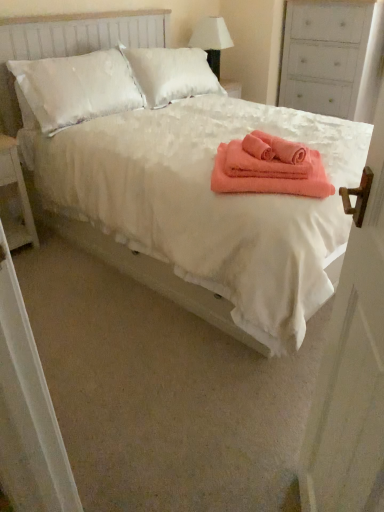
Describe the element at coordinates (76, 33) in the screenshot. The width and height of the screenshot is (384, 512). I see `coral soft towel at center` at that location.

Describe the element at coordinates (269, 168) in the screenshot. I see `coral plush bath towel at center` at that location.

What is the approximate height of coral plush bath towel at center?

coral plush bath towel at center is 3.92 inches in height.

Describe the element at coordinates (262, 161) in the screenshot. I see `coral soft towel at center` at that location.

Identify the location of white fabric lampshade at upper center. (212, 40).

Where is `coral soft towel at center`? The height and width of the screenshot is (512, 384). coral soft towel at center is located at coordinates (76, 33).

Can we say white wood nightstand at left lies outside coral soft towel at center?

Yes.

How far apart are white wood nightstand at left and coral soft towel at center?

white wood nightstand at left and coral soft towel at center are 4.57 feet apart from each other.

Based on the photo, does white wood nightstand at left have a greater height compared to coral soft towel at center?

Yes, white wood nightstand at left is taller than coral soft towel at center.

Is the depth of white wood nightstand at left greater than that of coral soft towel at center?

Yes, white wood nightstand at left is further from the camera.

Could you tell me if white painted wood dresser at upper right is turned towards white wood nightstand at left?

Yes.

What's the angular difference between white painted wood dresser at upper right and white wood nightstand at left's facing directions?

The facing directions of white painted wood dresser at upper right and white wood nightstand at left are 90 degrees apart.

From a real-world perspective, between white painted wood dresser at upper right and white wood nightstand at left, who is vertically higher?

In real-world perspective, white painted wood dresser at upper right is above.

Is there a large distance between white painted wood dresser at upper right and white wood nightstand at left?

white painted wood dresser at upper right is positioned a significant distance from white wood nightstand at left.

Based on their positions, is white fabric lampshade at upper center located to the left or right of white wooden door at right?

In the image, white fabric lampshade at upper center appears on the left side of white wooden door at right.

Is white fabric lampshade at upper center looking in the opposite direction of white wooden door at right?

No.

Which is nearer, (x=225, y=24) or (x=372, y=459)?

Point (x=225, y=24) appears to be farther away from the viewer than point (x=372, y=459).

Is coral soft towel at center in contact with coral soft towel at center?

No, coral soft towel at center is not making contact with coral soft towel at center.

The height and width of the screenshot is (512, 384). Find the location of `bed below the coral soft towel at center (from a real-world perspective)`. bed below the coral soft towel at center (from a real-world perspective) is located at coordinates (76, 33).

Considering their positions, is coral soft towel at center located in front of or behind coral soft towel at center?

Clearly, coral soft towel at center is in front of coral soft towel at center.

Which is more to the left, coral soft towel at center or coral soft towel at center?

coral soft towel at center.

Between white fabric lampshade at upper center and white painted wood dresser at upper right, which one has more height?

Standing taller between the two is white painted wood dresser at upper right.

Where is `table lamp above the white painted wood dresser at upper right (from the image's perspective)`? The height and width of the screenshot is (512, 384). table lamp above the white painted wood dresser at upper right (from the image's perspective) is located at coordinates (212, 40).

Is white fabric lampshade at upper center to the right of white painted wood dresser at upper right from the viewer's perspective?

Incorrect, white fabric lampshade at upper center is not on the right side of white painted wood dresser at upper right.

From a real-world perspective, is white fabric lampshade at upper center on white painted wood dresser at upper right?

Yes, from a real-world perspective, white fabric lampshade at upper center is above white painted wood dresser at upper right.

Is coral plush bath towel at center behind white painted wood dresser at upper right?

No.

From a real-world perspective, which object rests below the other?

coral plush bath towel at center is physically lower.

Between coral plush bath towel at center and white painted wood dresser at upper right, which one has larger size?

With larger size is white painted wood dresser at upper right.

You are a GUI agent. You are given a task and a screenshot of the screen. Output one action in this format:
    pyautogui.click(x=<x>, y=<y>)
    Task: Click on the bath towel in front of the white painted wood dresser at upper right
    The image size is (384, 512).
    Given the screenshot: What is the action you would take?
    pyautogui.click(x=269, y=168)

Relative to white wood nightstand at left, is white wooden door at right in front or behind?

Clearly, white wooden door at right is in front of white wood nightstand at left.

Can you confirm if white wooden door at right is taller than white wood nightstand at left?

Correct, white wooden door at right is much taller as white wood nightstand at left.

Is white wooden door at right inside or outside of white wood nightstand at left?

white wooden door at right exists outside the volume of white wood nightstand at left.

Is white wooden door at right turned away from white wood nightstand at left?

No, white wooden door at right is not facing away from white wood nightstand at left.

Where is `cloth that is in front of the white wood nightstand at left`? cloth that is in front of the white wood nightstand at left is located at coordinates coord(262,161).

Image resolution: width=384 pixels, height=512 pixels. What are the coordinates of `dresser above the white wood nightstand at left (from a real-world perspective)` in the screenshot? It's located at (323, 56).

From the image, which object appears to be farther from coral soft towel at center, coral soft towel at center or coral plush bath towel at center?

coral soft towel at center is further to coral soft towel at center.

Considering their positions, is white painted wood dresser at upper right positioned closer to white fabric lampshade at upper center than white wood nightstand at left?

white painted wood dresser at upper right is closer to white fabric lampshade at upper center.

From the picture: Estimate the real-world distances between objects in this image. Which object is further from white wooden door at right, white painted wood dresser at upper right or white wood nightstand at left?

white painted wood dresser at upper right is positioned further to the anchor white wooden door at right.

Estimate the real-world distances between objects in this image. Which object is closer to white painted wood dresser at upper right, white fabric lampshade at upper center or coral soft towel at center?

Among the two, white fabric lampshade at upper center is located nearer to white painted wood dresser at upper right.

Based on their spatial positions, is coral soft towel at center or white fabric lampshade at upper center closer to white wood nightstand at left?

coral soft towel at center lies closer to white wood nightstand at left than the other object.

Estimate the real-world distances between objects in this image. Which object is further from white fabric lampshade at upper center, white wooden door at right or white painted wood dresser at upper right?

white wooden door at right is further to white fabric lampshade at upper center.

Considering their positions, is coral plush bath towel at center positioned further to white wooden door at right than white painted wood dresser at upper right?

The object further to white wooden door at right is white painted wood dresser at upper right.

Estimate the real-world distances between objects in this image. Which object is closer to coral plush bath towel at center, white fabric lampshade at upper center or white wooden door at right?

Among the two, white wooden door at right is located nearer to coral plush bath towel at center.

The height and width of the screenshot is (512, 384). Identify the location of cloth between coral plush bath towel at center and white fabric lampshade at upper center along the z-axis. (262, 161).

The width and height of the screenshot is (384, 512). I want to click on bath towel between white wooden door at right and white fabric lampshade at upper center in the front-back direction, so click(269, 168).

Image resolution: width=384 pixels, height=512 pixels. Find the location of `cloth between coral soft towel at center and white painted wood dresser at upper right in the front-back direction`. cloth between coral soft towel at center and white painted wood dresser at upper right in the front-back direction is located at coordinates (262, 161).

At what (x,y) coordinates should I click in order to perform the action: click on bath towel between white wooden door at right and white wood nightstand at left in the front-back direction. Please return your answer as a coordinate pair (x, y). Looking at the image, I should click on (269, 168).